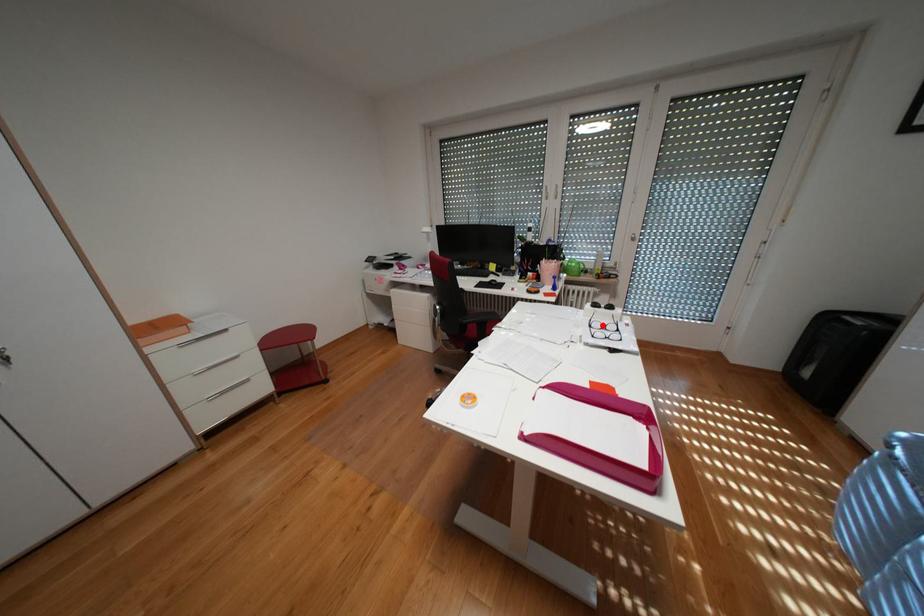
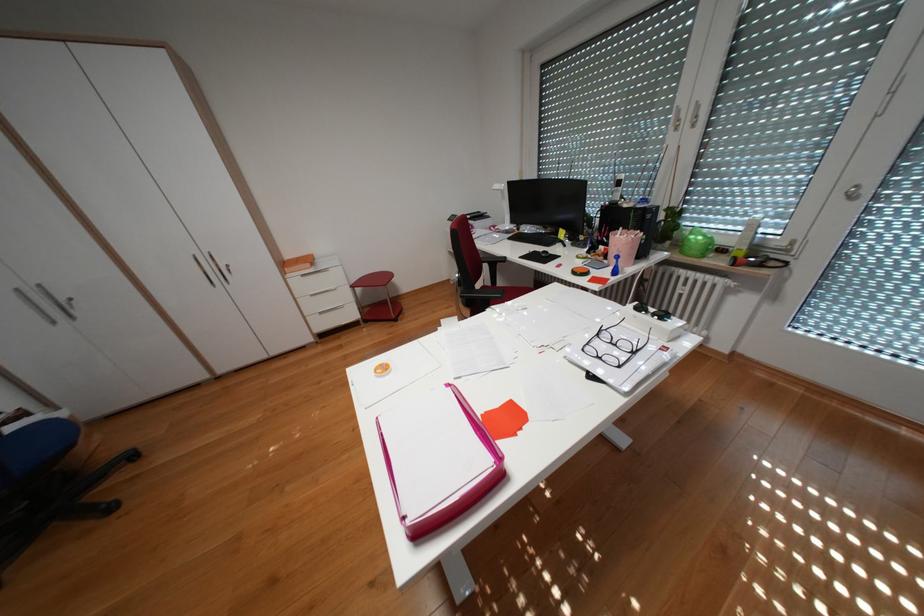
Locate, in the second image, the point that corresponds to the highlighted location in the first image.

(610, 334)